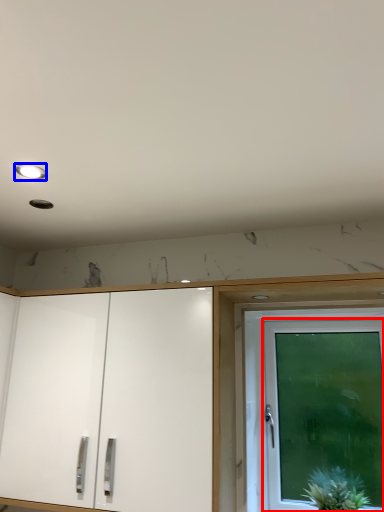
Question: Which of the following is the closest to the observer, door (highlighted by a red box) or lighting (highlighted by a blue box)?

Choices:
 (A) door
 (B) lighting

Answer: (B)